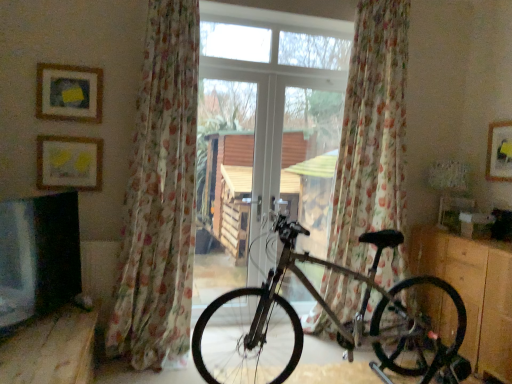
Question: In the image, is matte yellow picture frame at upper left, marked as the third picture frame in a right-to-left arrangement, positioned in front of or behind matte yellow picture frame at upper right, marked as the third picture frame in a left-to-right arrangement?

Choices:
 (A) front
 (B) behind

Answer: (A)

Question: Is matte yellow picture frame at upper left, which is the first picture frame from left to right, wider or thinner than matte yellow picture frame at upper right, the 1th picture frame in the right-to-left sequence?

Choices:
 (A) wide
 (B) thin

Answer: (B)

Question: Estimate the real-world distances between objects in this image. Which object is farther from the transparent glass door at center?

Choices:
 (A) matte yellow picture frame at upper left, marked as the third picture frame in a right-to-left arrangement
 (B) wooden bench at lower left
 (C) floral sheer curtain at left, which is counted as the first curtain, starting from the left
 (D) silver metallic bicycle at center
 (E) wooden dresser at lower right

Answer: (B)

Question: Considering the real-world distances, which object is farthest from the floral sheer curtain at center, the 1th curtain positioned from the right?

Choices:
 (A) matte gold picture frame at upper left, which ranks as the 1th picture frame in front-to-back order
 (B) transparent glass door at center
 (C) matte yellow picture frame at upper right, acting as the 1th picture frame starting from the back
 (D) matte yellow picture frame at upper left, marked as the third picture frame in a right-to-left arrangement
 (E) floral sheer curtain at left, which is counted as the first curtain, starting from the left

Answer: (A)